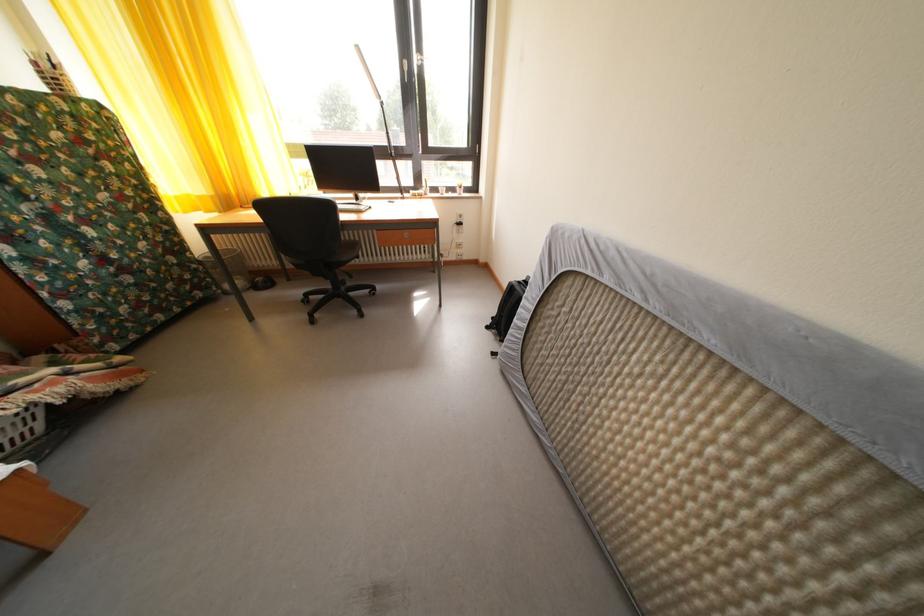
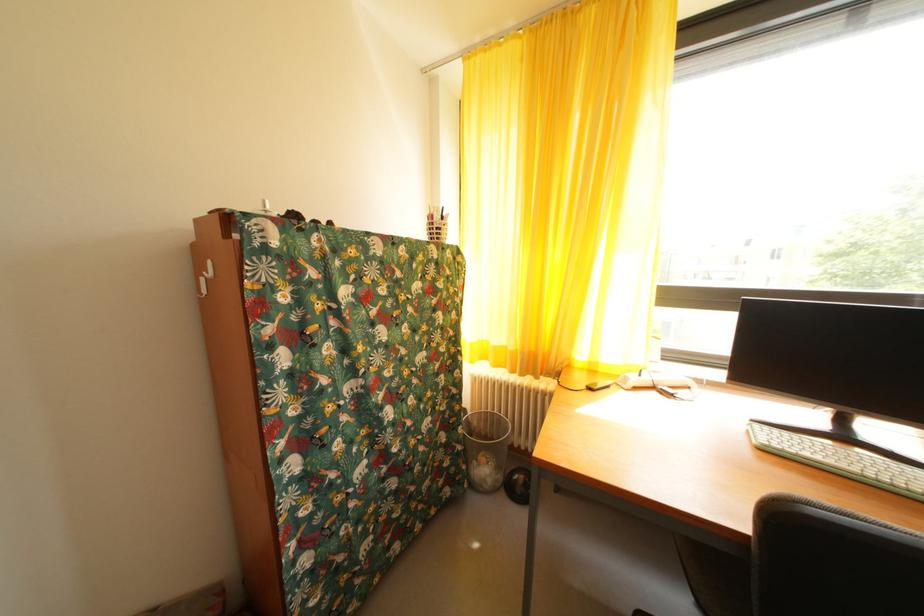
Find the pixel in the second image that matches pixel 43 70 in the first image.

(440, 223)